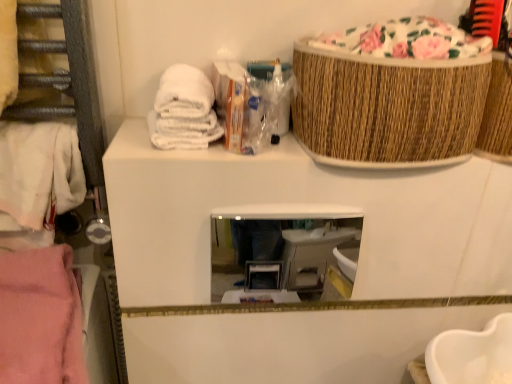
Describe the element at coordinates (40, 318) in the screenshot. I see `pink fabric at left, which is the 1th clothing in bottom-to-top order` at that location.

The image size is (512, 384). I want to click on woven brown basket at upper right, so click(x=387, y=108).

I want to click on pink fabric at left, the second clothing viewed from the top, so click(x=40, y=318).

Considering the positions of objects woven brown basket at upper right and clear glass mirror at center in the image provided, who is more to the left, woven brown basket at upper right or clear glass mirror at center?

clear glass mirror at center is more to the left.

The height and width of the screenshot is (384, 512). Find the location of `basket above the clear glass mirror at center (from a real-world perspective)`. basket above the clear glass mirror at center (from a real-world perspective) is located at coordinates (387, 108).

From a real-world perspective, is woven brown basket at upper right above or below clear glass mirror at center?

woven brown basket at upper right is above clear glass mirror at center.

Considering the relative sizes of woven brown basket at upper right and clear glass mirror at center in the image provided, is woven brown basket at upper right shorter than clear glass mirror at center?

Incorrect, the height of woven brown basket at upper right does not fall short of that of clear glass mirror at center.

Looking at this image, can you confirm if woven brown basket at upper right is wider than white cotton towel at left, which appears as the 1th clothing when viewed from the top?

Yes.

From the image's perspective, which one is positioned higher, woven brown basket at upper right or white cotton towel at left, which appears as the 1th clothing when viewed from the top?

woven brown basket at upper right.

This screenshot has height=384, width=512. In order to click on basket located on the right of white cotton towel at left, which appears as the 1th clothing when viewed from the top in this screenshot , I will do `click(387, 108)`.

Is clear glass mirror at center oriented towards pink fabric at left, which is the 1th clothing in bottom-to-top order?

No, clear glass mirror at center is not turned towards pink fabric at left, which is the 1th clothing in bottom-to-top order.

From the image's perspective, which one is positioned higher, clear glass mirror at center or pink fabric at left, which is the 1th clothing in bottom-to-top order?

clear glass mirror at center appears higher in the image.

Considering the relative sizes of clear glass mirror at center and pink fabric at left, which is the 1th clothing in bottom-to-top order, in the image provided, is clear glass mirror at center taller than pink fabric at left, which is the 1th clothing in bottom-to-top order,?

Yes, clear glass mirror at center is taller than pink fabric at left, which is the 1th clothing in bottom-to-top order.

Considering the positions of points (224, 280) and (59, 258), is point (224, 280) farther from camera compared to point (59, 258)?

That is True.

The image size is (512, 384). What are the coordinates of `clothing above the clear glass mirror at center (from a real-world perspective)` in the screenshot? It's located at (39, 171).

Is clear glass mirror at center aimed at white cotton towel at left, which appears as the 1th clothing when viewed from the top?

No, clear glass mirror at center is not oriented towards white cotton towel at left, which appears as the 1th clothing when viewed from the top.

Can you confirm if clear glass mirror at center is thinner than white cotton towel at left, the second clothing when ordered from bottom to top?

Yes.

From a real-world perspective, which object stands above the other?

white cotton towel at left, the second clothing when ordered from bottom to top, from a real-world perspective.

Looking at this image, from a real-world perspective, between clear glass mirror at center and woven brown basket at upper right, who is vertically higher?

woven brown basket at upper right.

Is the position of clear glass mirror at center more distant than that of woven brown basket at upper right?

Yes, it is behind woven brown basket at upper right.

Is clear glass mirror at center turned away from woven brown basket at upper right?

No, clear glass mirror at center is not facing the opposite direction of woven brown basket at upper right.

From a real-world perspective, which is physically above, woven brown basket at upper right or pink fabric at left, which is the 1th clothing in bottom-to-top order?

woven brown basket at upper right, from a real-world perspective.

Measure the distance between woven brown basket at upper right and pink fabric at left, the second clothing viewed from the top.

woven brown basket at upper right and pink fabric at left, the second clothing viewed from the top, are 53.10 centimeters apart from each other.

From the picture: Is woven brown basket at upper right beside pink fabric at left, which is the 1th clothing in bottom-to-top order?

No, woven brown basket at upper right is not with pink fabric at left, which is the 1th clothing in bottom-to-top order.

Is woven brown basket at upper right turned away from pink fabric at left, the second clothing viewed from the top?

No, woven brown basket at upper right's orientation is not away from pink fabric at left, the second clothing viewed from the top.

Measure the distance between white cotton towel at left, which appears as the 1th clothing when viewed from the top, and woven brown basket at upper right.

18.78 inches.

How many degrees apart are the facing directions of white cotton towel at left, which appears as the 1th clothing when viewed from the top, and woven brown basket at upper right?

white cotton towel at left, which appears as the 1th clothing when viewed from the top, and woven brown basket at upper right are facing 2.26 degrees away from each other.

Could you tell me if white cotton towel at left, which appears as the 1th clothing when viewed from the top, is facing woven brown basket at upper right?

No.

Is point (84, 187) closer or farther from the camera than point (338, 154)?

Point (84, 187).

There is a clear glass mirror at center. Where is `basket above it (from a real-world perspective)`? basket above it (from a real-world perspective) is located at coordinates (387, 108).

You are a GUI agent. You are given a task and a screenshot of the screen. Output one action in this format:
    pyautogui.click(x=<x>, y=<y>)
    Task: Click on the clothing that is the 2nd object to the left of the woven brown basket at upper right, starting at the anchor
    The image size is (512, 384).
    Given the screenshot: What is the action you would take?
    pyautogui.click(x=39, y=171)

From the image, which object appears to be nearer to woven brown basket at upper right, white cotton towel at left, the second clothing when ordered from bottom to top, or pink fabric at left, which is the 1th clothing in bottom-to-top order?

The object closer to woven brown basket at upper right is white cotton towel at left, the second clothing when ordered from bottom to top.

Which object lies nearer to the anchor point white cotton towel at left, the second clothing when ordered from bottom to top, woven brown basket at upper right or clear glass mirror at center?

Among the two, woven brown basket at upper right is located nearer to white cotton towel at left, the second clothing when ordered from bottom to top.

Based on their spatial positions, is white cotton towel at left, the second clothing when ordered from bottom to top, or pink fabric at left, the second clothing viewed from the top, further from clear glass mirror at center?

pink fabric at left, the second clothing viewed from the top, is positioned further to the anchor clear glass mirror at center.

Looking at the image, which one is located further to pink fabric at left, which is the 1th clothing in bottom-to-top order, woven brown basket at upper right or clear glass mirror at center?

clear glass mirror at center is positioned further to the anchor pink fabric at left, which is the 1th clothing in bottom-to-top order.

Which object lies nearer to the anchor point pink fabric at left, the second clothing viewed from the top, white cotton towel at left, the second clothing when ordered from bottom to top, or clear glass mirror at center?

Among the two, white cotton towel at left, the second clothing when ordered from bottom to top, is located nearer to pink fabric at left, the second clothing viewed from the top.

From the image, which object appears to be nearer to woven brown basket at upper right, white cotton towel at left, which appears as the 1th clothing when viewed from the top, or clear glass mirror at center?

Based on the image, white cotton towel at left, which appears as the 1th clothing when viewed from the top, appears to be nearer to woven brown basket at upper right.

From the image, which object appears to be farther from pink fabric at left, which is the 1th clothing in bottom-to-top order, clear glass mirror at center or white cotton towel at left, the second clothing when ordered from bottom to top?

Based on the image, clear glass mirror at center appears to be further to pink fabric at left, which is the 1th clothing in bottom-to-top order.

When comparing their distances from white cotton towel at left, which appears as the 1th clothing when viewed from the top, does pink fabric at left, which is the 1th clothing in bottom-to-top order, or woven brown basket at upper right seem closer?

pink fabric at left, which is the 1th clothing in bottom-to-top order, is closer to white cotton towel at left, which appears as the 1th clothing when viewed from the top.

Locate an element on the screen. The height and width of the screenshot is (384, 512). clothing between white cotton towel at left, which appears as the 1th clothing when viewed from the top, and clear glass mirror at center, in the horizontal direction is located at coordinates (40, 318).

Locate an element on the screen. Image resolution: width=512 pixels, height=384 pixels. clothing between white cotton towel at left, the second clothing when ordered from bottom to top, and woven brown basket at upper right, in the horizontal direction is located at coordinates (40, 318).

The width and height of the screenshot is (512, 384). I want to click on mirror between pink fabric at left, which is the 1th clothing in bottom-to-top order, and woven brown basket at upper right, in the horizontal direction, so click(280, 255).

You are a GUI agent. You are given a task and a screenshot of the screen. Output one action in this format:
    pyautogui.click(x=<x>, y=<y>)
    Task: Click on the mirror between white cotton towel at left, the second clothing when ordered from bottom to top, and woven brown basket at upper right from left to right
    The image size is (512, 384).
    Given the screenshot: What is the action you would take?
    pyautogui.click(x=280, y=255)